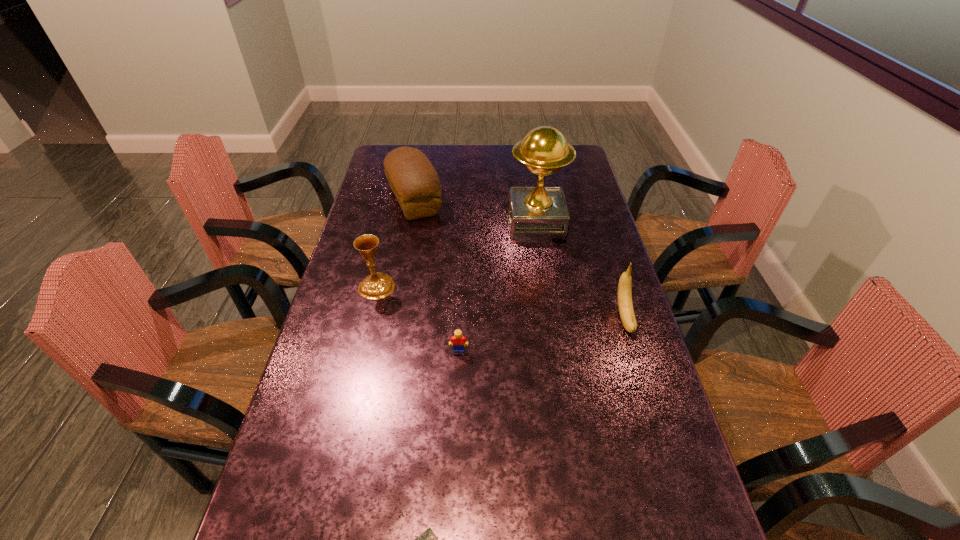
Where is `vacant point located 0.290m on the front of the bread`? Image resolution: width=960 pixels, height=540 pixels. vacant point located 0.290m on the front of the bread is located at coordinates (398, 281).

I want to click on blank space located on the front of the chalice, so click(357, 368).

This screenshot has width=960, height=540. What are the coordinates of `vacant space located at the start of the peel on the rightmost object` in the screenshot? It's located at (639, 363).

Find the location of `free space located on the face of the fifth farthest object`. free space located on the face of the fifth farthest object is located at coordinates (455, 448).

Image resolution: width=960 pixels, height=540 pixels. In order to click on bread that is at the left edge in this screenshot , I will do `click(412, 178)`.

The height and width of the screenshot is (540, 960). I want to click on chalice positioned at the left edge, so click(378, 285).

Locate an element on the screen. This screenshot has height=540, width=960. award positioned at the right edge is located at coordinates (536, 214).

This screenshot has height=540, width=960. What are the coordinates of `banana present at the right edge` in the screenshot? It's located at (625, 304).

At what (x,y) coordinates should I click in order to perform the action: click on free space at the far edge. Please return your answer as a coordinate pair (x, y). The height and width of the screenshot is (540, 960). Looking at the image, I should click on (428, 153).

Locate an element on the screen. Image resolution: width=960 pixels, height=540 pixels. free location at the left edge of the desktop is located at coordinates (337, 440).